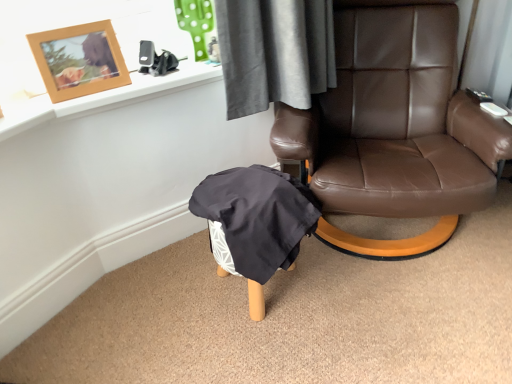
Question: Is black plastic remote control at upper right, acting as the 2th remote control starting from the back, facing towards black plastic remote control at upper right, acting as the 2th remote control starting from the bottom?

Choices:
 (A) no
 (B) yes

Answer: (A)

Question: Is black plastic remote control at upper right, acting as the 2th remote control starting from the back, positioned behind black plastic remote control at upper right, which appears as the 2th remote control when viewed from the front?

Choices:
 (A) yes
 (B) no

Answer: (B)

Question: Is black plastic remote control at upper right, acting as the 2th remote control starting from the back, smaller than black plastic remote control at upper right, acting as the 2th remote control starting from the bottom?

Choices:
 (A) no
 (B) yes

Answer: (B)

Question: Considering the relative sizes of black plastic remote control at upper right, acting as the 2th remote control starting from the back, and black plastic remote control at upper right, the first remote control in the top-to-bottom sequence, in the image provided, is black plastic remote control at upper right, acting as the 2th remote control starting from the back, bigger than black plastic remote control at upper right, the first remote control in the top-to-bottom sequence,?

Choices:
 (A) no
 (B) yes

Answer: (A)

Question: From the image's perspective, would you say black plastic remote control at upper right, acting as the 2th remote control starting from the back, is positioned over black plastic remote control at upper right, which appears as the 2th remote control when viewed from the front?

Choices:
 (A) yes
 (B) no

Answer: (B)

Question: Is black plastic remote control at upper right, acting as the 2th remote control starting from the back, touching black plastic remote control at upper right, the first remote control in the top-to-bottom sequence?

Choices:
 (A) no
 (B) yes

Answer: (A)

Question: Is dark gray fabric bean bag chair at lower center completely or partially outside of woodenobject at upper left?

Choices:
 (A) no
 (B) yes

Answer: (B)

Question: From the image's perspective, does dark gray fabric bean bag chair at lower center appear lower than woodenobject at upper left?

Choices:
 (A) no
 (B) yes

Answer: (B)

Question: Could you tell me if dark gray fabric bean bag chair at lower center is facing woodenobject at upper left?

Choices:
 (A) yes
 (B) no

Answer: (B)

Question: Is dark gray fabric bean bag chair at lower center touching woodenobject at upper left?

Choices:
 (A) no
 (B) yes

Answer: (A)

Question: Is woodenobject at upper left a part of dark gray fabric bean bag chair at lower center?

Choices:
 (A) no
 (B) yes

Answer: (A)

Question: Is woodenobject at upper left at the back of dark gray fabric bean bag chair at lower center?

Choices:
 (A) yes
 (B) no

Answer: (B)

Question: Does dark gray fabric bean bag chair at lower center have a greater width compared to black plastic remote control at upper right, acting as the 2th remote control starting from the back?

Choices:
 (A) no
 (B) yes

Answer: (B)